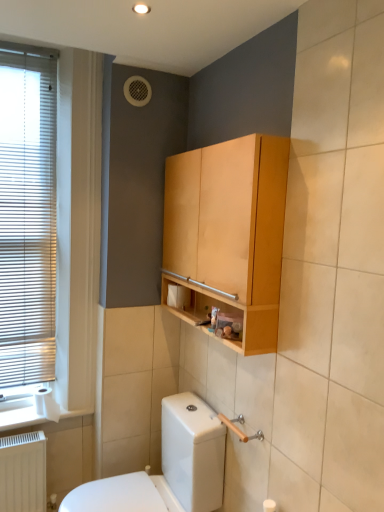
Question: Should I look upward or downward to see white matte toilet paper at lower left, the second toilet paper in the top-to-bottom sequence?

Choices:
 (A) up
 (B) down

Answer: (B)

Question: Is light brown wood cabinet at upper center turned away from metallic silver toiletries at center?

Choices:
 (A) yes
 (B) no

Answer: (A)

Question: From the image's perspective, is light brown wood cabinet at upper center located above metallic silver toiletries at center?

Choices:
 (A) no
 (B) yes

Answer: (B)

Question: From the image's perspective, is light brown wood cabinet at upper center beneath metallic silver toiletries at center?

Choices:
 (A) yes
 (B) no

Answer: (B)

Question: Is light brown wood cabinet at upper center to the right of metallic silver toiletries at center from the viewer's perspective?

Choices:
 (A) yes
 (B) no

Answer: (B)

Question: Can you confirm if light brown wood cabinet at upper center is shorter than metallic silver toiletries at center?

Choices:
 (A) no
 (B) yes

Answer: (A)

Question: From a real-world perspective, is light brown wood cabinet at upper center positioned under metallic silver toiletries at center based on gravity?

Choices:
 (A) yes
 (B) no

Answer: (B)

Question: Is white glossy toilet at lower left to the left of white matte toilet paper at lower center, which is the 1th toilet paper in top-to-bottom order, from the viewer's perspective?

Choices:
 (A) yes
 (B) no

Answer: (A)

Question: Considering the relative sizes of white glossy toilet at lower left and white matte toilet paper at lower center, which is counted as the second toilet paper, starting from the left, in the image provided, is white glossy toilet at lower left bigger than white matte toilet paper at lower center, which is counted as the second toilet paper, starting from the left,?

Choices:
 (A) yes
 (B) no

Answer: (A)

Question: Would you say white glossy toilet at lower left is a long distance from white matte toilet paper at lower center, which is the 1th toilet paper in top-to-bottom order?

Choices:
 (A) yes
 (B) no

Answer: (B)

Question: Can you confirm if white glossy toilet at lower left is smaller than white matte toilet paper at lower center, which is the second toilet paper from bottom to top?

Choices:
 (A) no
 (B) yes

Answer: (A)

Question: Is white glossy toilet at lower left surrounding white matte toilet paper at lower center, which is counted as the second toilet paper, starting from the left?

Choices:
 (A) no
 (B) yes

Answer: (A)

Question: Considering the relative sizes of white glossy toilet at lower left and white matte toilet paper at lower center, acting as the first toilet paper starting from the right, in the image provided, is white glossy toilet at lower left shorter than white matte toilet paper at lower center, acting as the first toilet paper starting from the right,?

Choices:
 (A) yes
 (B) no

Answer: (B)

Question: Does white matte toilet paper at lower left, which ranks as the 1th toilet paper in bottom-to-top order, have a larger size compared to light brown wood cabinet at upper center?

Choices:
 (A) no
 (B) yes

Answer: (A)